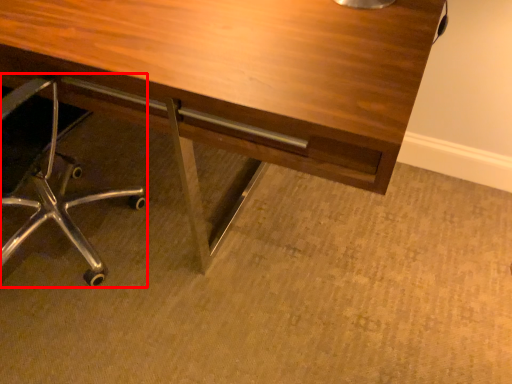
Question: In this image, where is chair (annotated by the red box) located relative to desk?

Choices:
 (A) right
 (B) left

Answer: (B)